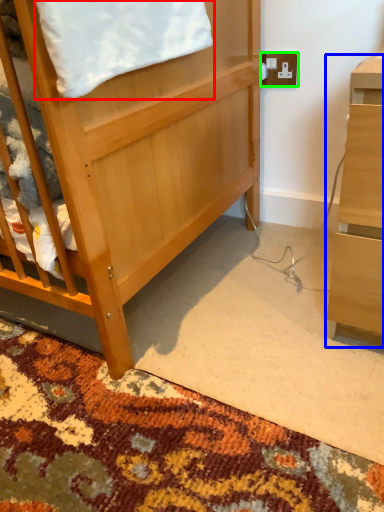
Question: Which object is the farthest from blanket (highlighted by a red box)? Choose among these: desk (highlighted by a blue box) or electric outlet (highlighted by a green box).

Choices:
 (A) desk
 (B) electric outlet

Answer: (B)